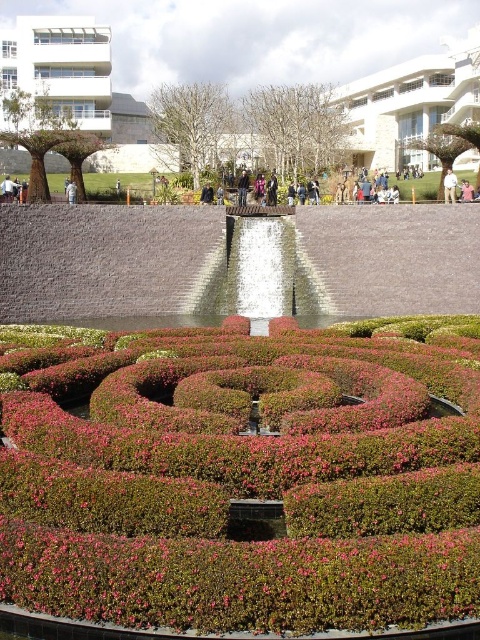
From the picture: You are a visitor in the garden and want to sit down. You see the light beige pants at center and the light brown wooden bench at center. Which one can you sit on?

The light brown wooden bench at center can be sat on because it is larger than the light beige pants at center, which likely cannot support sitting.

You are standing in the garden and want to sit down. You see the light beige pants at center and the light brown wooden bench at center. Which object is suitable for sitting?

The light brown wooden bench at center is suitable for sitting, while the light beige pants at center are clothing and not meant for sitting.

You are standing in the garden and want to take a photo of the green leafy hedge at center. If your camera can focus on objects up to 70 feet away, will you need to move closer to capture the hedge clearly?

The green leafy hedge at center is 71.84 feet away from the viewer. Since the camera can only focus up to 70 feet, you need to move closer to ensure the hedge is in focus.